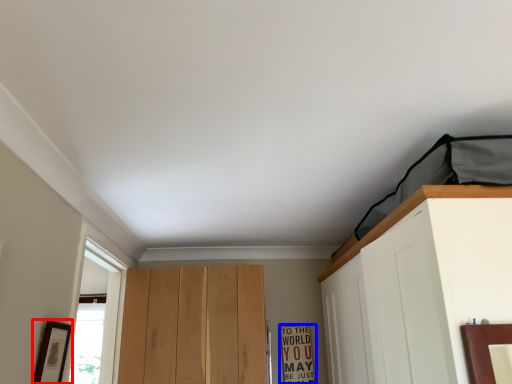
Question: Which object appears farthest to the camera in this image, picture frame (highlighted by a red box) or warning sign (highlighted by a blue box)?

Choices:
 (A) picture frame
 (B) warning sign

Answer: (B)